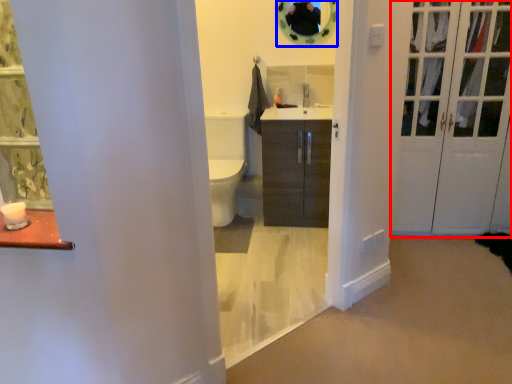
Question: Which point is further to the camera, door (highlighted by a red box) or mirror (highlighted by a blue box)?

Choices:
 (A) door
 (B) mirror

Answer: (B)